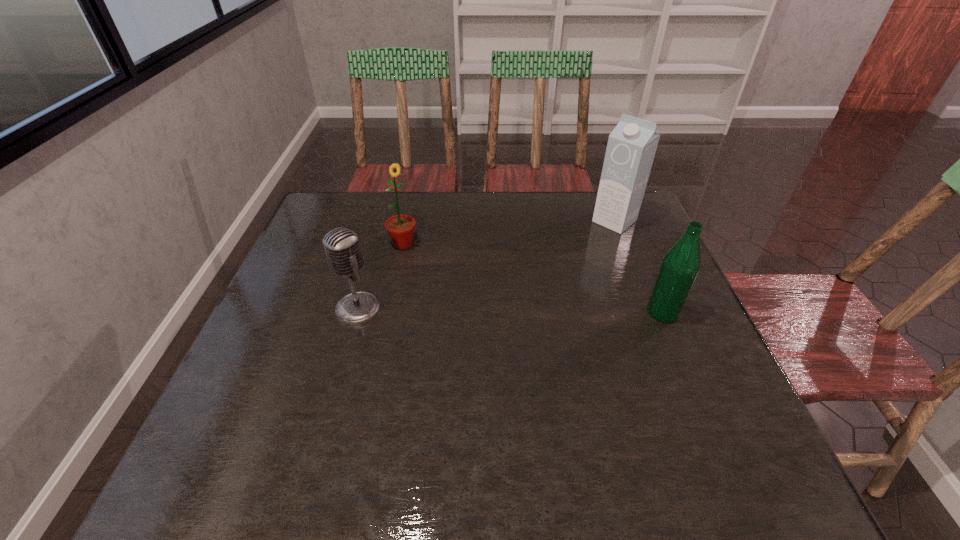
Where is `free space that is in between the bottle and the tallest object`? free space that is in between the bottle and the tallest object is located at coordinates (638, 267).

Find the location of a particular element. the closest object to the second farthest object is located at coordinates (342, 247).

Identify the location of object that is the second closest to the bottle. The image size is (960, 540). (401, 228).